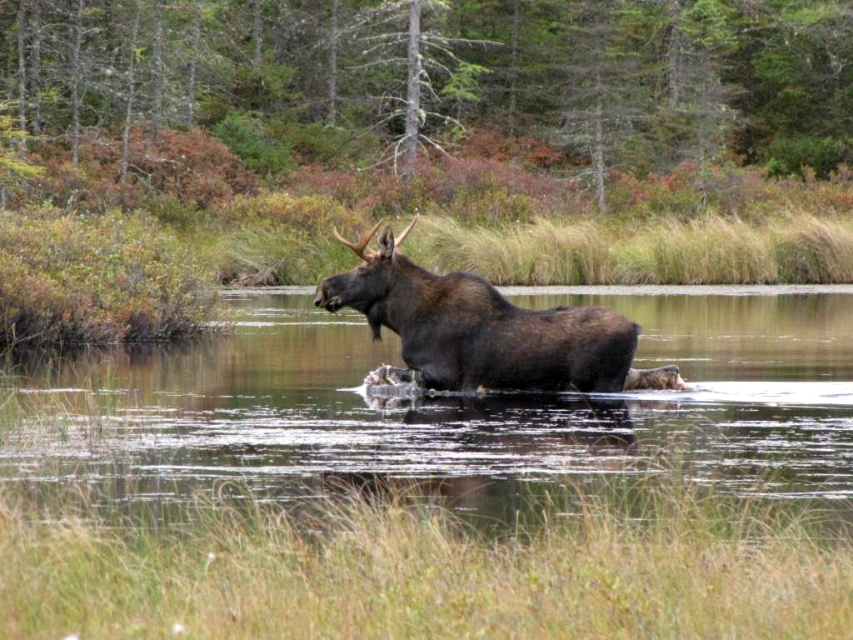
You are a wildlife photographer aiming to capture a close shot of the brown water at center. Your camera has a maximum zoom range of 5 meters. Can you get a clear shot without moving closer?

The brown water at center and camera are 6.45 meters apart from each other, so the camera cannot zoom enough to capture a close shot since its maximum range is 5 meters. You need to move closer or use a different camera with better zoom.

You are a photographer trying to capture the brown furry moose at center in the brown water at center. Can you determine if the moose is standing in the water based on the scene?

The brown water at center is positioned under brown furry moose at center, so yes, the moose is standing in the water.

You are a photographer trying to capture the brown furry moose at center. You notice the brown water at center is in the way. Can you focus on the moose without the water being in the foreground?

The brown water at center is closer to the viewer than the brown furry moose at center, so the water will be in the foreground and obstruct the view of the moose.